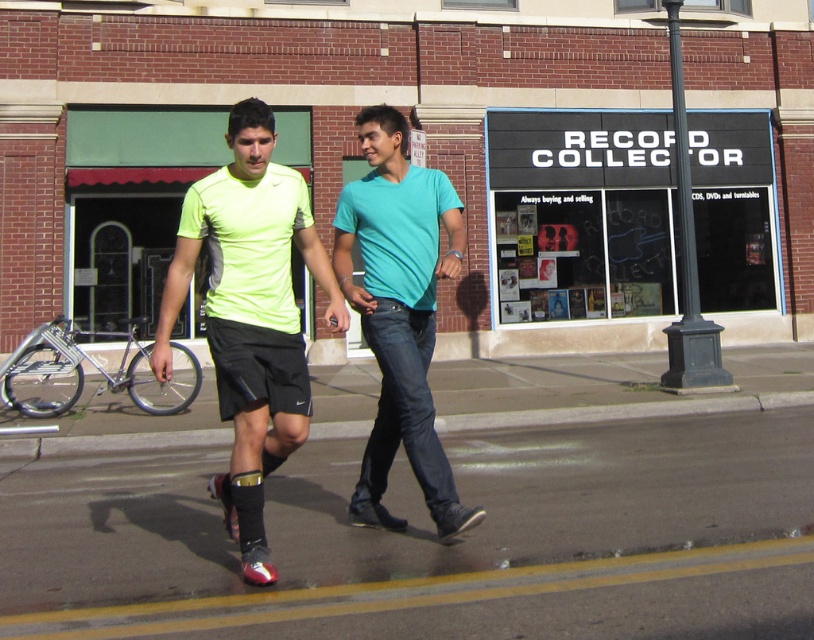
Is black matte sign at upper center positioned in front of teal matte shirt at center?

No, black matte sign at upper center is behind teal matte shirt at center.

Does black matte sign at upper center appear on the left side of teal matte shirt at center?

Incorrect, black matte sign at upper center is not on the left side of teal matte shirt at center.

Is point (729, 188) positioned before point (400, 396)?

No, it is behind (400, 396).

Find the location of a particular element. This screenshot has width=814, height=640. black matte sign at upper center is located at coordinates (584, 214).

Who is more distant from viewer, [274,168] or [394,364]?

The point [394,364] is more distant.

Is neon green fabric shirt at center to the right of teal matte shirt at center from the viewer's perspective?

Incorrect, neon green fabric shirt at center is not on the right side of teal matte shirt at center.

Who is more distant from viewer, (202,196) or (395,157)?

Point (395,157)

Find the location of a particular element. The width and height of the screenshot is (814, 640). neon green fabric shirt at center is located at coordinates (250, 314).

Is smooth asphalt road at center positioned in front of black matte sign at upper center?

That is True.

Is smooth asphalt road at center wider than black matte sign at upper center?

In fact, smooth asphalt road at center might be narrower than black matte sign at upper center.

Describe the element at coordinates (434, 540) in the screenshot. I see `smooth asphalt road at center` at that location.

Where is `smooth asphalt road at center`? This screenshot has width=814, height=640. smooth asphalt road at center is located at coordinates (434, 540).